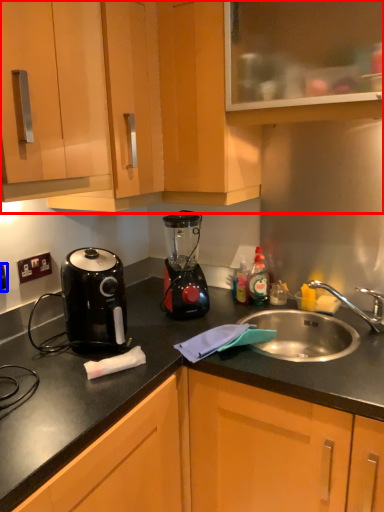
Question: Which point is further to the camera, cabinetry (highlighted by a red box) or electric outlet (highlighted by a blue box)?

Choices:
 (A) cabinetry
 (B) electric outlet

Answer: (B)